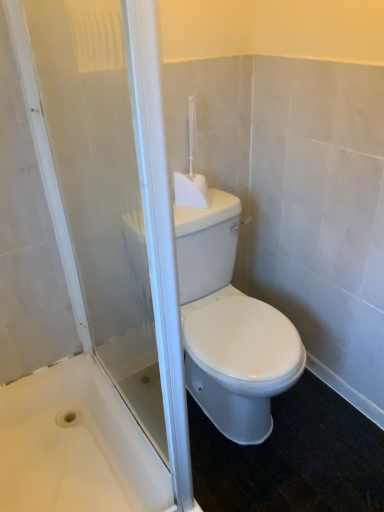
Question: Does white glossy bathtub at lower left have a lesser height compared to white glossy toilet at center?

Choices:
 (A) yes
 (B) no

Answer: (A)

Question: Is white glossy bathtub at lower left wider than white glossy toilet at center?

Choices:
 (A) yes
 (B) no

Answer: (A)

Question: Considering the relative sizes of white glossy bathtub at lower left and white glossy toilet at center in the image provided, is white glossy bathtub at lower left taller than white glossy toilet at center?

Choices:
 (A) no
 (B) yes

Answer: (A)

Question: From a real-world perspective, is white glossy bathtub at lower left over white glossy toilet at center?

Choices:
 (A) yes
 (B) no

Answer: (B)

Question: Does white glossy bathtub at lower left have a smaller size compared to white glossy toilet at center?

Choices:
 (A) yes
 (B) no

Answer: (A)

Question: Is white glossy bathtub at lower left next to white glossy toilet at center and touching it?

Choices:
 (A) no
 (B) yes

Answer: (A)

Question: Does transparent glass screen door at center appear on the left side of white glossy bathtub at lower left?

Choices:
 (A) no
 (B) yes

Answer: (A)

Question: From a real-world perspective, is transparent glass screen door at center beneath white glossy bathtub at lower left?

Choices:
 (A) no
 (B) yes

Answer: (A)

Question: From the image's perspective, is transparent glass screen door at center located beneath white glossy bathtub at lower left?

Choices:
 (A) no
 (B) yes

Answer: (A)

Question: Does transparent glass screen door at center have a greater width compared to white glossy bathtub at lower left?

Choices:
 (A) yes
 (B) no

Answer: (B)

Question: From the image's perspective, is transparent glass screen door at center on white glossy bathtub at lower left?

Choices:
 (A) yes
 (B) no

Answer: (A)

Question: Considering the relative positions of transparent glass screen door at center and white glossy bathtub at lower left in the image provided, is transparent glass screen door at center to the right of white glossy bathtub at lower left from the viewer's perspective?

Choices:
 (A) yes
 (B) no

Answer: (A)

Question: From a real-world perspective, is white glossy toilet at center beneath white glossy bathtub at lower left?

Choices:
 (A) no
 (B) yes

Answer: (A)